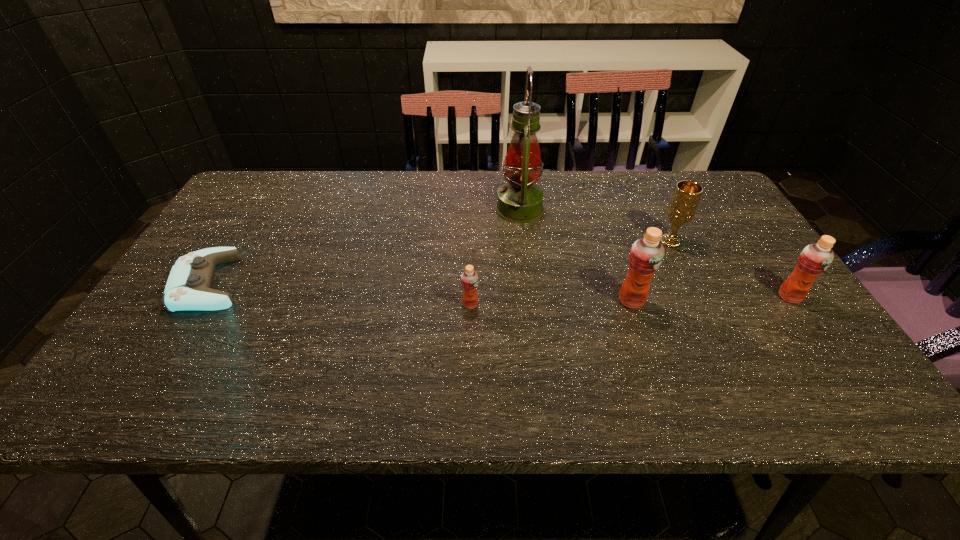
Where is `empty space between the leftmost orange juice and the fifth object from left to right`? empty space between the leftmost orange juice and the fifth object from left to right is located at coordinates (570, 273).

Identify the location of free space between the control and the third object from right to left. (420, 292).

Identify which object is the fourth closest to the chalice. Please provide its 2D coordinates. Your answer should be formatted as a tuple, i.e. [(x, y)], where the tuple contains the x and y coordinates of a point satisfying the conditions above.

[(469, 279)]

Locate which object is the closest to the shortest object. Please provide its 2D coordinates. Your answer should be formatted as a tuple, i.e. [(x, y)], where the tuple contains the x and y coordinates of a point satisfying the conditions above.

[(469, 279)]

Identify the location of orange juice that is the closest one to the second orange juice from right to left. This screenshot has height=540, width=960. (815, 258).

Choose which orange juice is the second nearest neighbor to the third object from right to left. Please provide its 2D coordinates. Your answer should be formatted as a tuple, i.e. [(x, y)], where the tuple contains the x and y coordinates of a point satisfying the conditions above.

[(469, 279)]